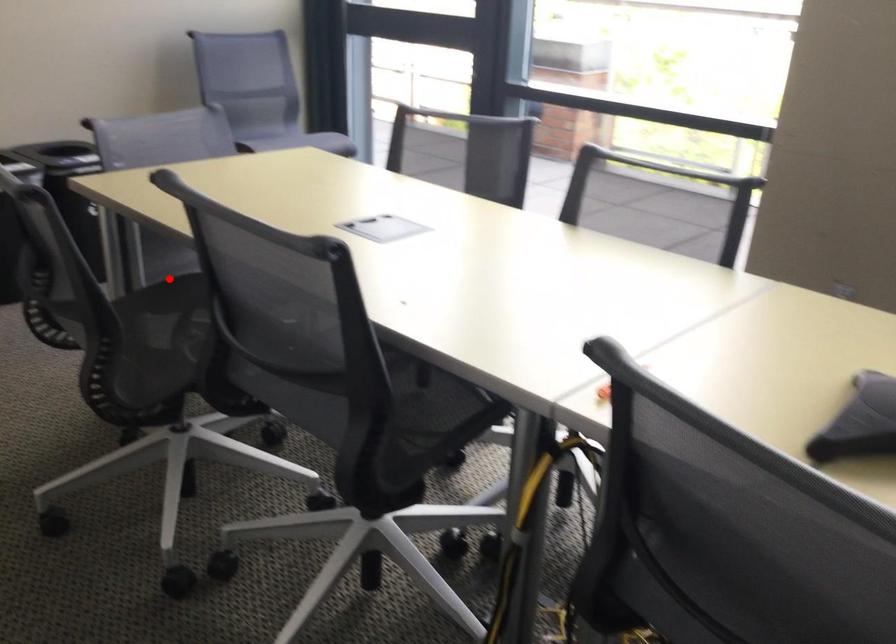
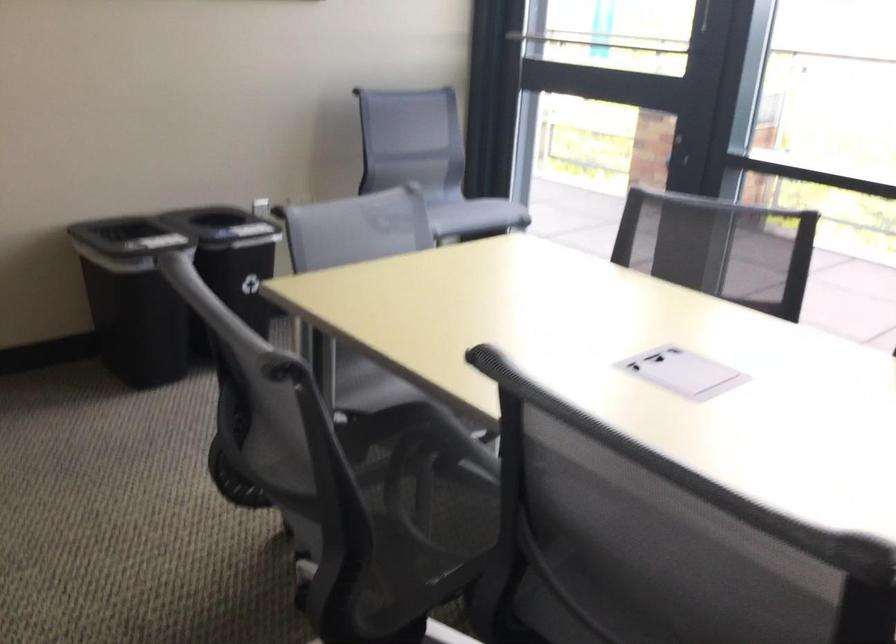
Question: I am providing you with two images of the same scene from different viewpoints. In image1, a red point is highlighted. Considering the same 3D point in image2, which of the following is correct?

Choices:
 (A) It is closer
 (B) It is farther

Answer: (A)